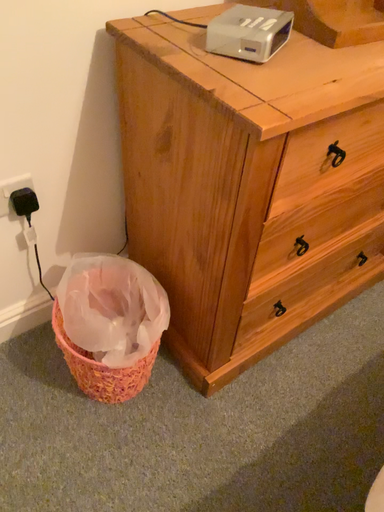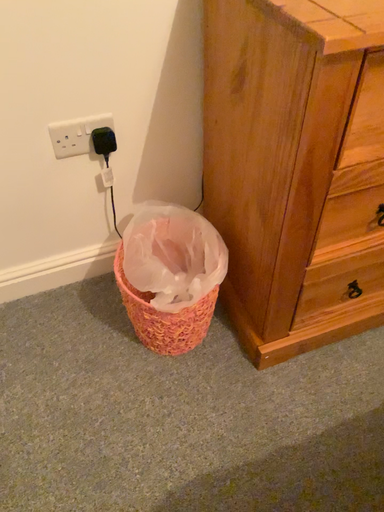
Question: Which way did the camera rotate in the video?

Choices:
 (A) rotated right
 (B) rotated left

Answer: (B)